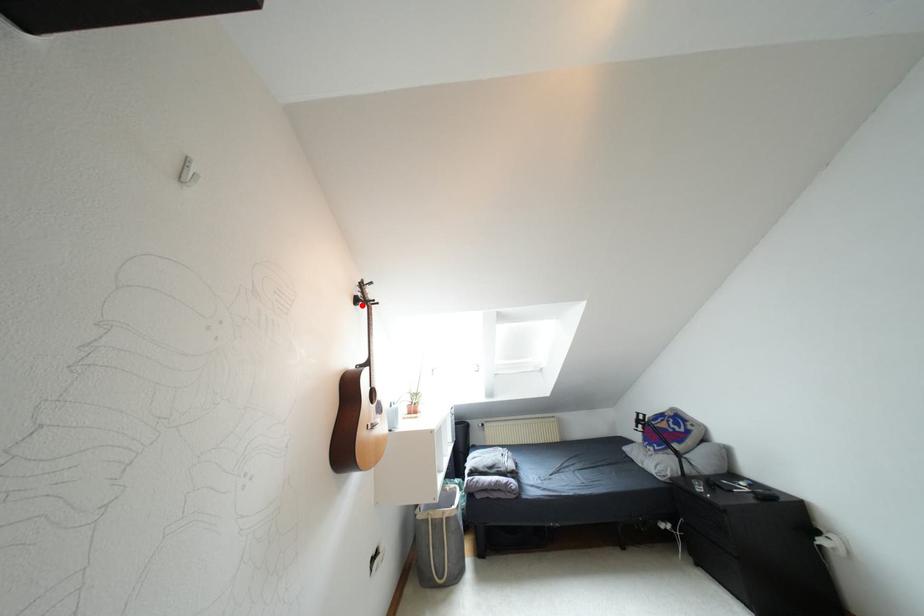
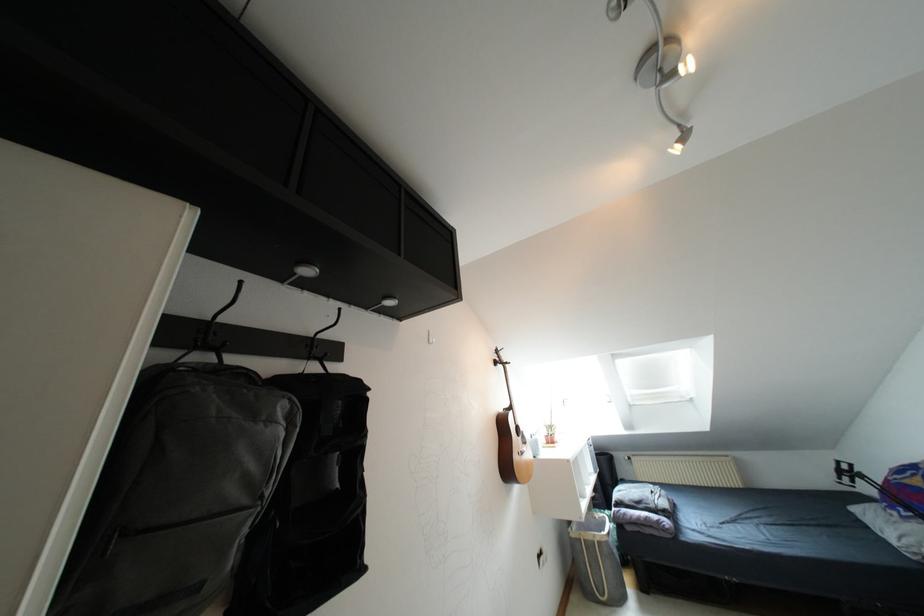
Locate, in the second image, the point that corresponds to the highlighted location in the first image.

(499, 366)